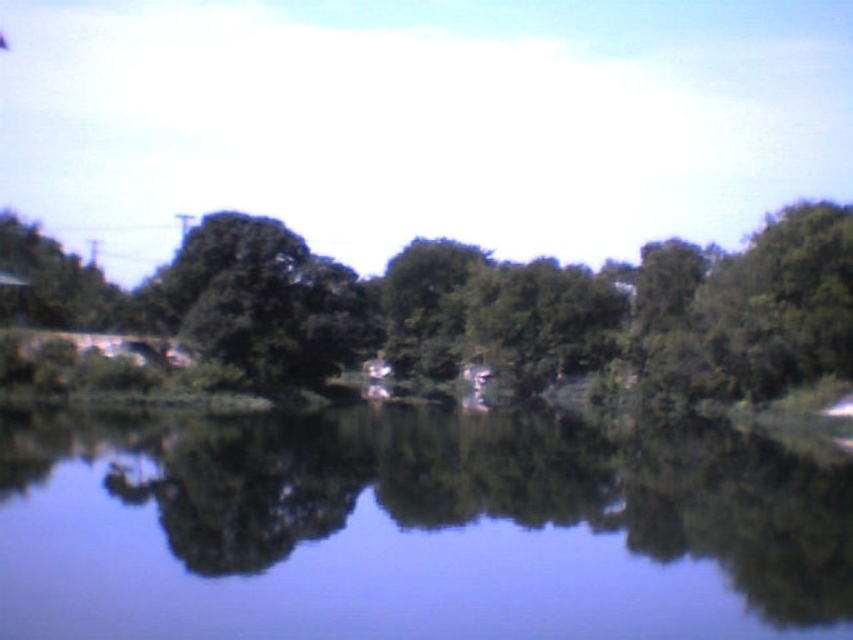
Question: Is the position of transparent water at center less distant than that of green leafy tree at center?

Choices:
 (A) yes
 (B) no

Answer: (A)

Question: Does transparent water at center appear on the left side of green leafy tree at center?

Choices:
 (A) yes
 (B) no

Answer: (B)

Question: Is transparent water at center closer to camera compared to green leafy tree at center?

Choices:
 (A) yes
 (B) no

Answer: (A)